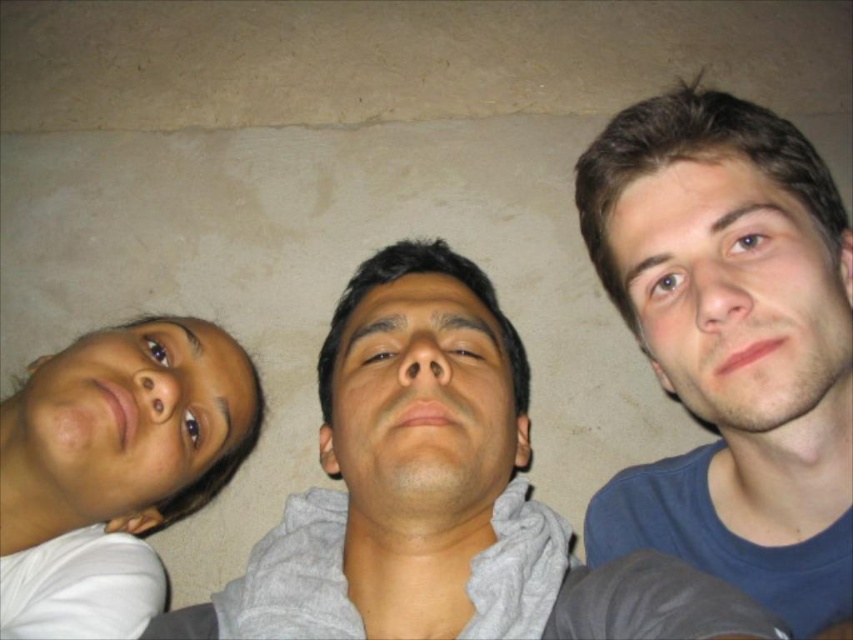
You are a photographer trying to capture a group photo of the matte skin face at left and the smooth skin face at center. Since you want to ensure both faces are in focus, which one should you adjust the camera focus on first?

You should adjust the camera focus on the matte skin face at left first because it is closer to the viewer than the smooth skin face at center. This way, you can ensure both are in focus by focusing on the closer subject first.

You are a photographer adjusting the focus of your camera. The camera has a focus point at position coordinates of 0.461, 0.863. Which object in the scene should you focus on to capture the smooth skin face at right clearly?

The smooth skin face at right is positioned at point (x=735, y=296), so focusing the camera at that coordinate will ensure the smooth skin face at right is in clear focus.

Looking at the three people in the image, you notice the blue cotton shirt at right and the matte skin face at left. Which of these two is positioned more to the right side of the image?

The blue cotton shirt at right is positioned more to the right side of the image than the matte skin face at left.